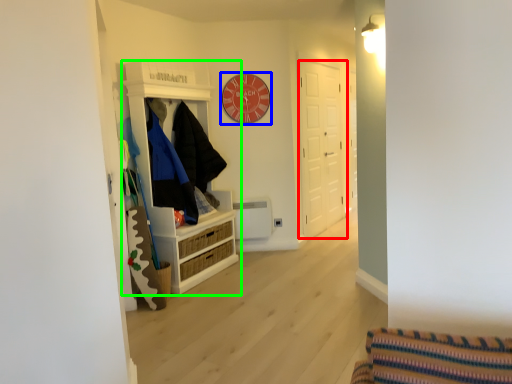
Question: Based on their relative distances, which object is farther from door (highlighted by a red box)? Choose from clock (highlighted by a blue box) and cabinetry (highlighted by a green box).

Choices:
 (A) clock
 (B) cabinetry

Answer: (B)